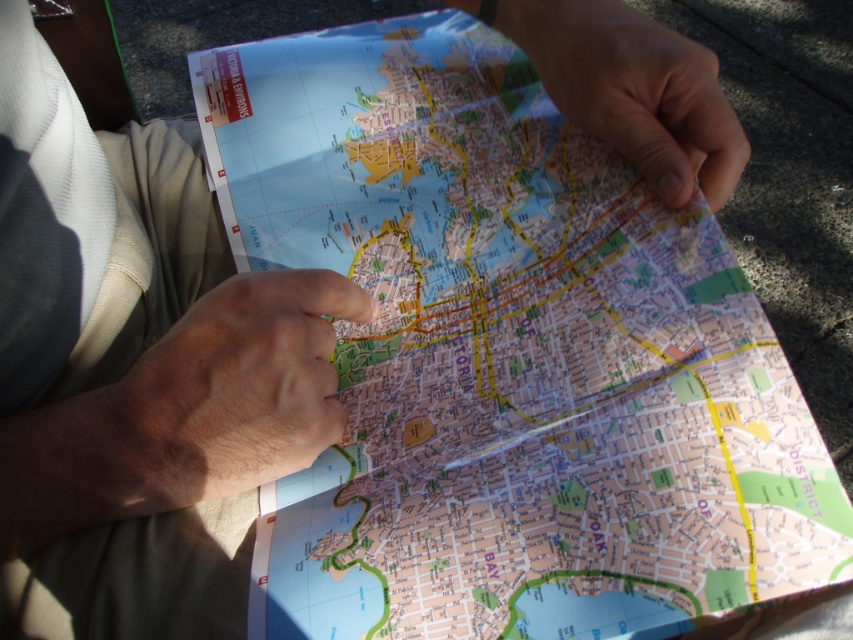
You are a tour guide pointing out two landmarks on the map to a tourist. The landmarks are located at point [236,324] and point [628,20]. Which landmark is closer to you on the map?

The landmark at point [236,324] is closer to you on the map because it is nearer to the camera compared to the landmark at point [628,20].

Based on the scene description, where is the smooth skin hand at center located in terms of coordinates?

The smooth skin hand at center is located at coordinates point (230, 392).

You are a tour guide holding a city map and pointing at a landmark. Your left hand is the smooth skin hand at center, and your right hand is the matte paper hand at upper right. Which hand is wider?

The matte paper hand at upper right is wider than the smooth skin hand at center.